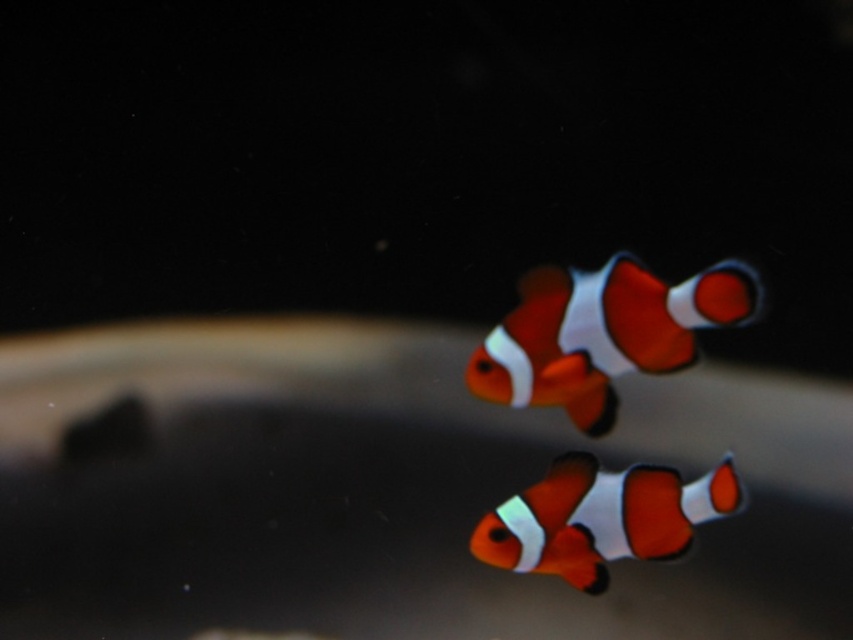
Question: Does orange and white clownfish at center have a larger size compared to orange matte clownfish at lower center?

Choices:
 (A) yes
 (B) no

Answer: (A)

Question: Is orange and white clownfish at center bigger than orange matte clownfish at lower center?

Choices:
 (A) no
 (B) yes

Answer: (B)

Question: Which point is farther to the camera?

Choices:
 (A) (596, 435)
 (B) (556, 544)

Answer: (A)

Question: From the image, what is the correct spatial relationship of orange and white clownfish at center in relation to orange matte clownfish at lower center?

Choices:
 (A) left
 (B) right

Answer: (B)

Question: Which object appears closest to the camera in this image?

Choices:
 (A) orange matte clownfish at lower center
 (B) orange and white clownfish at center

Answer: (B)